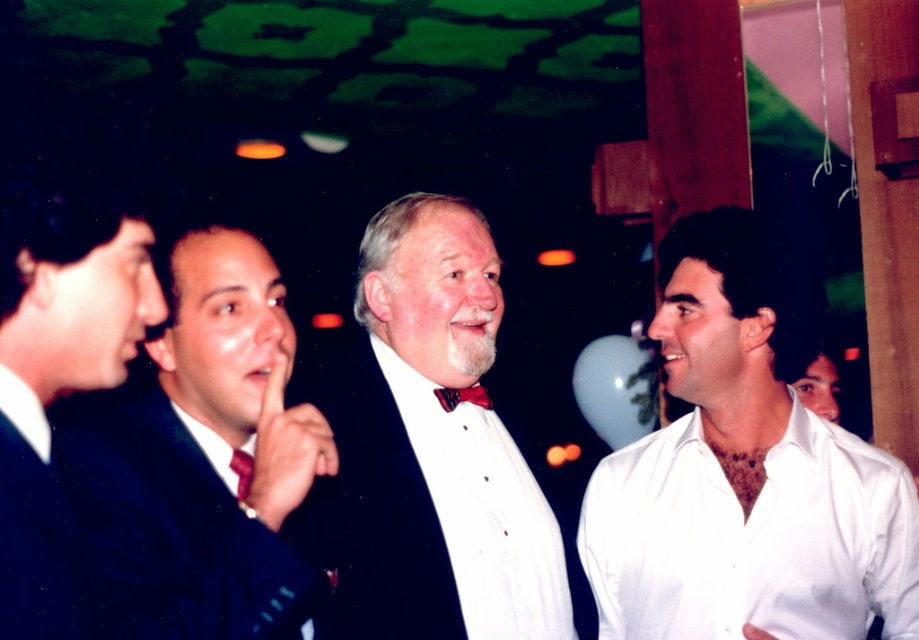
You are a photographer at a social event. You need to capture a photo where both the white cotton shirt at right and the shiny dark suit at center are visible. Which object should be placed closer to the camera to ensure both are fully in frame?

The white cotton shirt at right is taller than the shiny dark suit at center, so placing the white cotton shirt at right closer to the camera will ensure both are fully visible in the photo.

Based on the scene description, can you determine if the white cotton shirt at right has a larger width compared to the shiny red tie at center?

The white cotton shirt at right might be wider than shiny red tie at center according to the description.